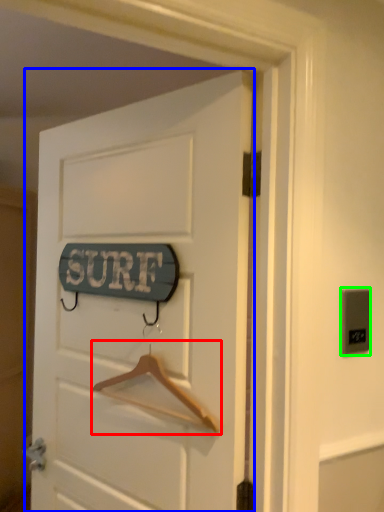
Question: Based on their relative distances, which object is farther from hanger (highlighted by a red box)? Choose from door (highlighted by a blue box) and electric outlet (highlighted by a green box).

Choices:
 (A) door
 (B) electric outlet

Answer: (B)